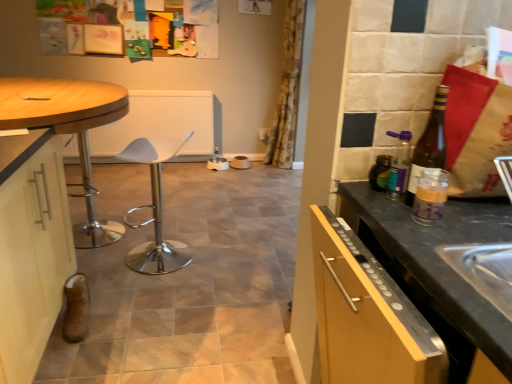
Where is `free space to the left of white plastic bar stool at center`? free space to the left of white plastic bar stool at center is located at coordinates (106, 257).